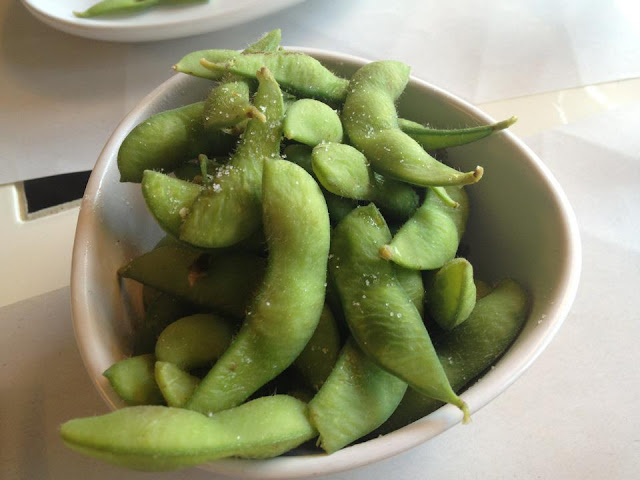
Where is `right rim of bowl`? right rim of bowl is located at coordinates (575, 240).